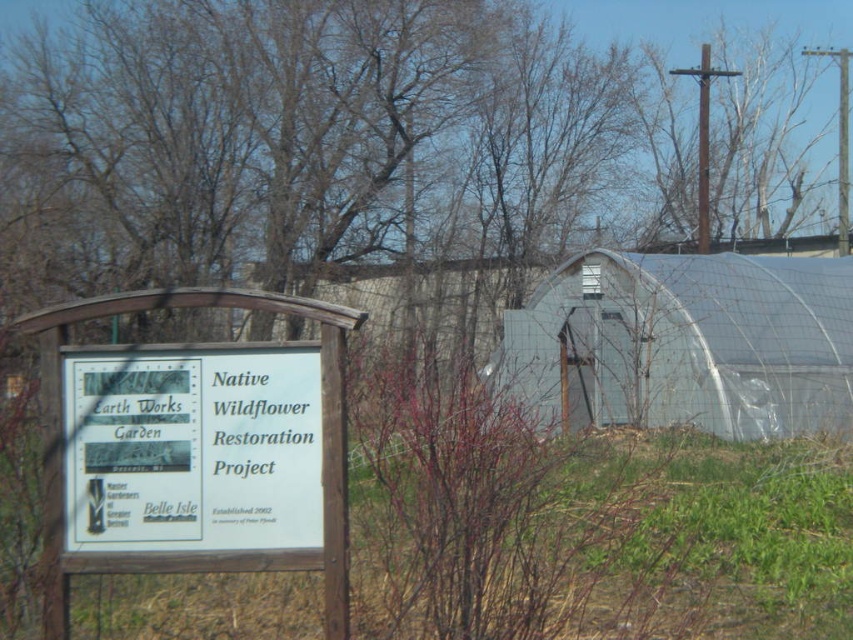
Who is more forward, (x=590, y=435) or (x=254, y=433)?

Point (x=254, y=433)

Where is `bare branches at center`? The height and width of the screenshot is (640, 853). bare branches at center is located at coordinates (494, 513).